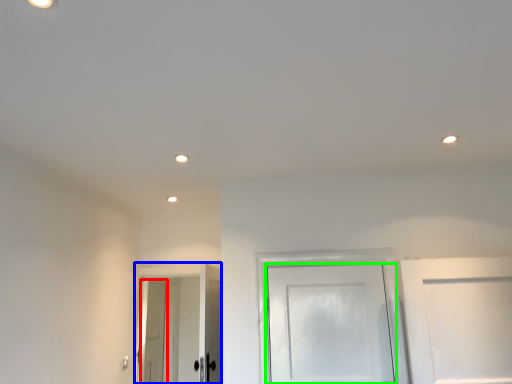
Question: Which object is the closest to the door (highlighted by a red box)? Choose among these: door (highlighted by a blue box) or door (highlighted by a green box).

Choices:
 (A) door
 (B) door

Answer: (A)